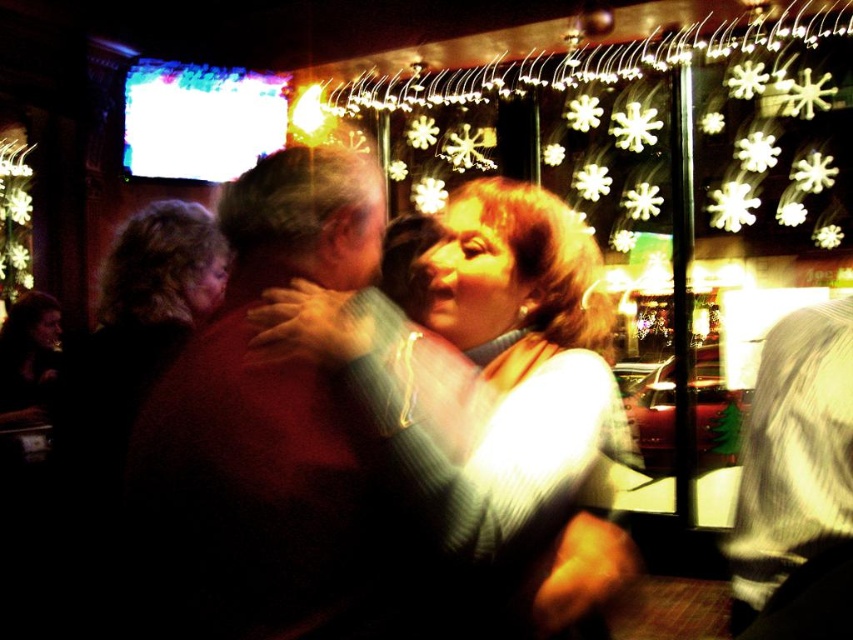
You are at a party and want to take a photo of the matte green sweater at center and the smooth dark brown shirt at center. Since you want to capture both fully in the frame, which one should you focus on to ensure the entire height of both is visible?

The matte green sweater at center has a greater height compared to the smooth dark brown shirt at center. Therefore, focusing on the matte green sweater at center will ensure the entire height of both items is visible in the photo.

You are planning to take a photo of the matte green sweater at center and the illuminated plastic snowflake at upper center. Which object should you focus on first if you want to capture both clearly in the same frame?

You should focus on the illuminated plastic snowflake at upper center first because it is larger than the matte green sweater at center, making it more prominent in the frame.